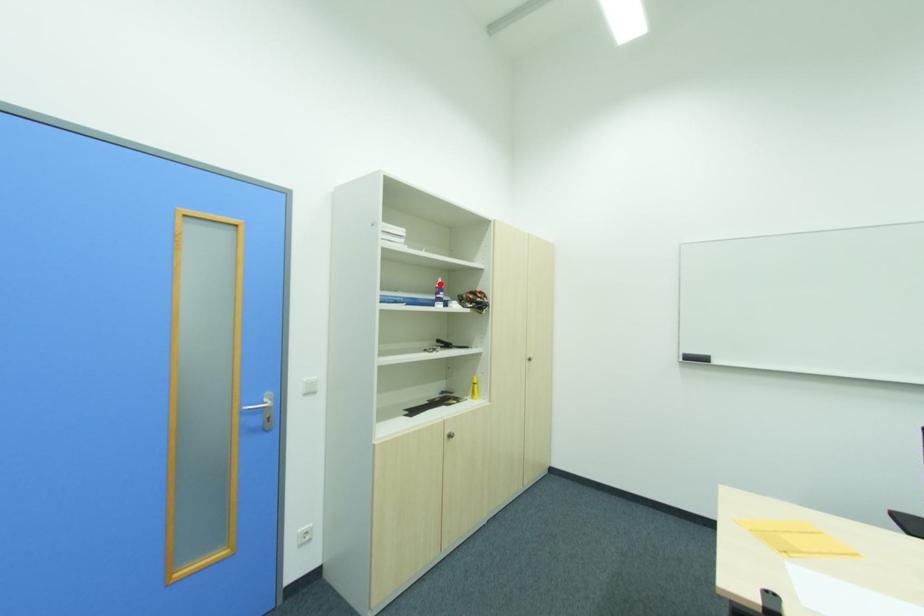
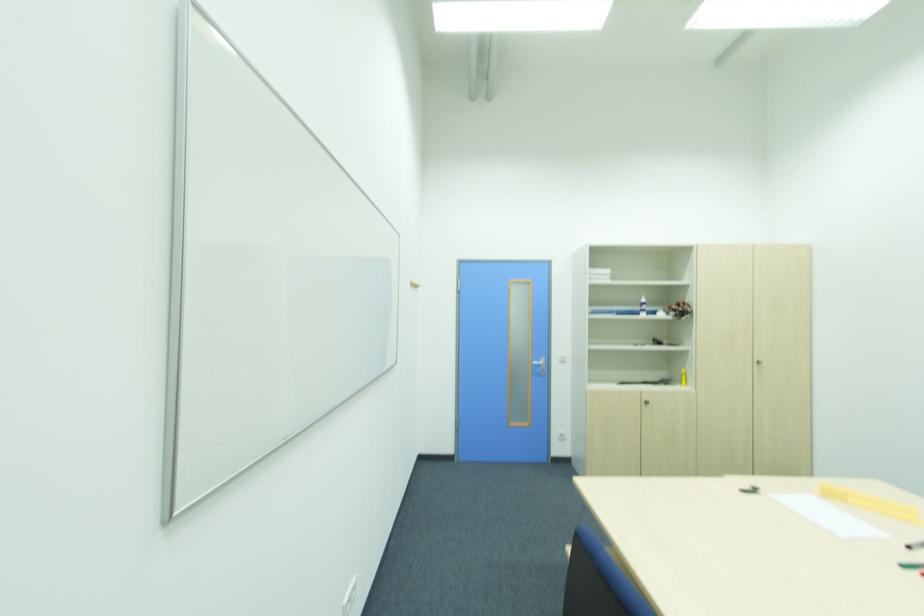
In the second image, find the point that corresponds to the highlighted location in the first image.

(643, 301)